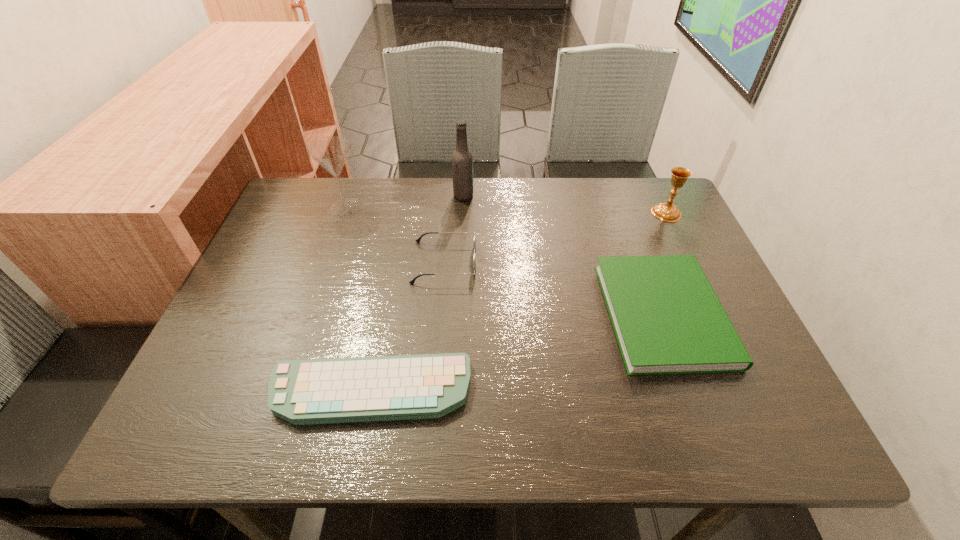
Locate an element on the screen. This screenshot has width=960, height=540. beer bottle is located at coordinates [462, 160].

Locate an element on the screen. This screenshot has height=540, width=960. the second tallest object is located at coordinates (331, 152).

You are a GUI agent. You are given a task and a screenshot of the screen. Output one action in this format:
    pyautogui.click(x=<x>, y=<y>)
    Task: Click on the fourth shortest object
    This screenshot has height=540, width=960.
    Given the screenshot: What is the action you would take?
    pyautogui.click(x=669, y=212)

You are a GUI agent. You are given a task and a screenshot of the screen. Output one action in this format:
    pyautogui.click(x=<x>, y=<y>)
    Task: Click on the third shortest object
    The image size is (960, 540).
    Given the screenshot: What is the action you would take?
    pyautogui.click(x=474, y=235)

The width and height of the screenshot is (960, 540). I want to click on the second shortest object, so click(667, 319).

Where is `the shortest object`? the shortest object is located at coordinates (339, 390).

Find the location of `free location located 0.390m on the label of the tallest object`. free location located 0.390m on the label of the tallest object is located at coordinates [607, 196].

I want to click on free location located 0.330m on the right of the flute glass, so click(482, 207).

Image resolution: width=960 pixels, height=540 pixels. I want to click on blank space located on the left of the fourth shortest object, so click(x=509, y=213).

Locate an element on the screen. blank space located 0.120m on the front-facing side of the sunglasses is located at coordinates (524, 262).